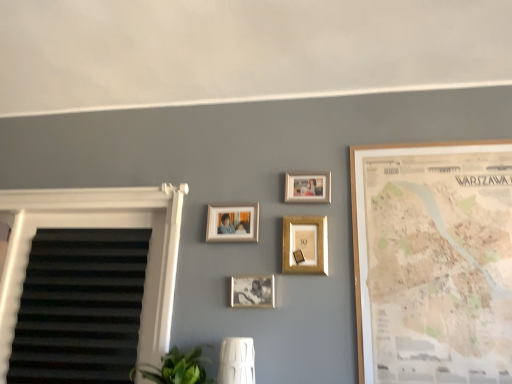
Question: From the image's perspective, is gold metallic picture frame at center, marked as the third picture frame in a right-to-left arrangement, beneath wooden map at right, positioned as the 1th picture frame in right-to-left order?

Choices:
 (A) yes
 (B) no

Answer: (B)

Question: Is gold metallic picture frame at center, marked as the third picture frame in a right-to-left arrangement, positioned far away from wooden map at right, positioned as the 1th picture frame in right-to-left order?

Choices:
 (A) yes
 (B) no

Answer: (B)

Question: Considering the relative positions of gold metallic picture frame at center, marked as the third picture frame in a right-to-left arrangement, and wooden map at right, positioned as the 1th picture frame in right-to-left order, in the image provided, is gold metallic picture frame at center, marked as the third picture frame in a right-to-left arrangement, behind wooden map at right, positioned as the 1th picture frame in right-to-left order,?

Choices:
 (A) yes
 (B) no

Answer: (A)

Question: Does gold metallic picture frame at center, positioned as the 3th picture frame in left-to-right order, have a lesser height compared to wooden map at right, positioned as the 1th picture frame in right-to-left order?

Choices:
 (A) no
 (B) yes

Answer: (B)

Question: Can you confirm if gold metallic picture frame at center, marked as the third picture frame in a right-to-left arrangement, is taller than wooden map at right, positioned as the 1th picture frame in right-to-left order?

Choices:
 (A) yes
 (B) no

Answer: (B)

Question: In the image, is matte gold picture frame at upper center, which is the second picture frame from right to left, positioned in front of or behind metallic silver photo frame at center, which is the 2th picture frame in left-to-right order?

Choices:
 (A) behind
 (B) front

Answer: (A)

Question: Would you say matte gold picture frame at upper center, which is the second picture frame from right to left, is to the left or to the right of metallic silver photo frame at center, which is the 2th picture frame in left-to-right order, in the picture?

Choices:
 (A) left
 (B) right

Answer: (B)

Question: From the image's perspective, relative to metallic silver photo frame at center, which is the 2th picture frame in left-to-right order, is matte gold picture frame at upper center, which is the second picture frame from right to left, above or below?

Choices:
 (A) above
 (B) below

Answer: (A)

Question: Looking at their shapes, would you say matte gold picture frame at upper center, which is counted as the 4th picture frame, starting from the left, is wider or thinner than metallic silver photo frame at center, which is the 2th picture frame in left-to-right order?

Choices:
 (A) thin
 (B) wide

Answer: (B)

Question: Based on their sizes in the image, would you say gold metallic picture frame at center, marked as the third picture frame in a right-to-left arrangement, is bigger or smaller than green leafy plant at lower center?

Choices:
 (A) small
 (B) big

Answer: (A)

Question: Considering the relative positions of gold metallic picture frame at center, positioned as the 3th picture frame in left-to-right order, and green leafy plant at lower center in the image provided, is gold metallic picture frame at center, positioned as the 3th picture frame in left-to-right order, to the left or to the right of green leafy plant at lower center?

Choices:
 (A) left
 (B) right

Answer: (B)

Question: Considering their positions, is gold metallic picture frame at center, marked as the third picture frame in a right-to-left arrangement, located in front of or behind green leafy plant at lower center?

Choices:
 (A) front
 (B) behind

Answer: (B)

Question: From the image's perspective, is gold metallic picture frame at center, marked as the third picture frame in a right-to-left arrangement, above or below green leafy plant at lower center?

Choices:
 (A) above
 (B) below

Answer: (A)

Question: In terms of height, does green leafy plant at lower center look taller or shorter compared to wooden map at right, positioned as the 1th picture frame in right-to-left order?

Choices:
 (A) short
 (B) tall

Answer: (A)

Question: From a real-world perspective, is green leafy plant at lower center physically located above or below wooden map at right, positioned as the 1th picture frame in right-to-left order?

Choices:
 (A) above
 (B) below

Answer: (B)